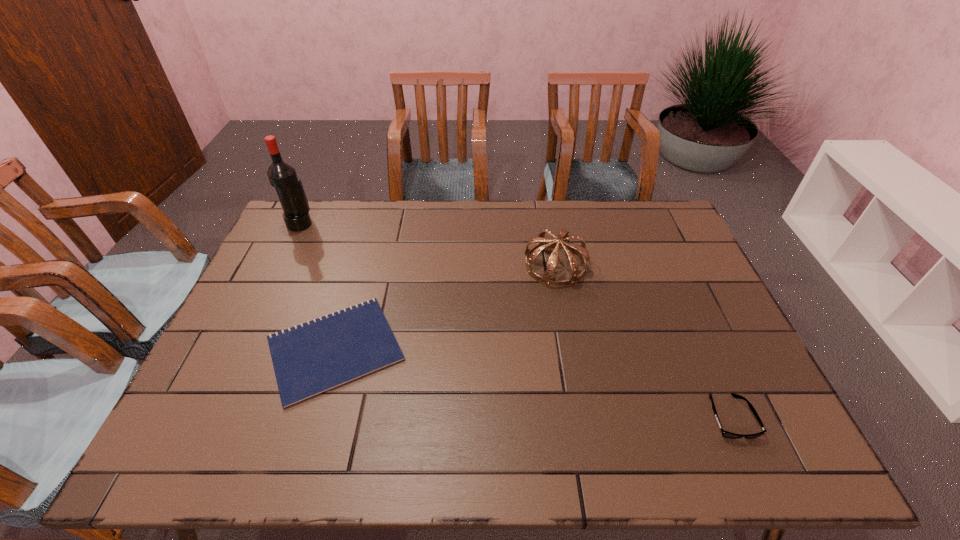
At what (x,y) coordinates should I click in order to perform the action: click on the farthest object. Please return your answer as a coordinate pair (x, y). Looking at the image, I should click on (282, 175).

Where is `the leftmost object`? The height and width of the screenshot is (540, 960). the leftmost object is located at coordinates (282, 175).

Find the location of a particular element. The width and height of the screenshot is (960, 540). the second farthest object is located at coordinates (562, 241).

I want to click on the third shortest object, so click(x=562, y=241).

Image resolution: width=960 pixels, height=540 pixels. What are the coordinates of `the rightmost object` in the screenshot? It's located at (725, 434).

The image size is (960, 540). In order to click on the third tallest object in this screenshot , I will do pos(725,434).

Locate an element on the screen. This screenshot has height=540, width=960. the third object from right to left is located at coordinates (314, 357).

Locate an element on the screen. notepad is located at coordinates (314, 357).

Locate an element on the screen. The height and width of the screenshot is (540, 960). vacant space located 0.090m on the right of the leftmost object is located at coordinates (338, 224).

Identify the location of vacant area situated 0.120m on the right of the third nearest object. (624, 266).